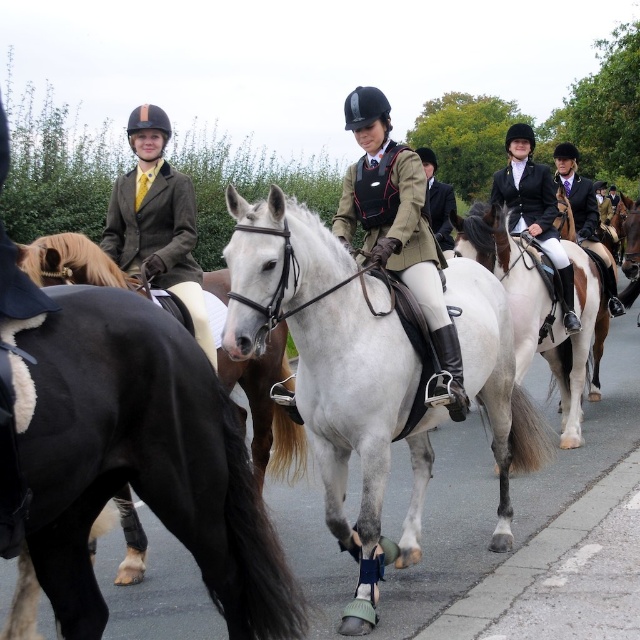
Does black leather jacket at center appear over matte black jacket at center?

No, black leather jacket at center is not above matte black jacket at center.

Is black leather jacket at center behind matte black jacket at center?

No, it is not.

Who is more distant from viewer, [518,216] or [608,264]?

The point [608,264] is behind.

The height and width of the screenshot is (640, 640). What are the coordinates of `black leather jacket at center` in the screenshot? It's located at (532, 209).

Is matte black vest at center wider than matte black jacket at center?

Incorrect, matte black vest at center's width does not surpass matte black jacket at center's.

Does matte black vest at center appear over matte black jacket at center?

Incorrect, matte black vest at center is not positioned above matte black jacket at center.

The image size is (640, 640). Describe the element at coordinates (400, 230) in the screenshot. I see `matte black vest at center` at that location.

Where is `matte black vest at center`? matte black vest at center is located at coordinates (400, 230).

Is white glossy horse at center in front of matte black vest at center?

No.

Who is shorter, white glossy horse at center or matte black vest at center?

white glossy horse at center

This screenshot has height=640, width=640. What do you see at coordinates (445, 532) in the screenshot?
I see `white glossy horse at center` at bounding box center [445, 532].

The image size is (640, 640). Identify the location of white glossy horse at center. (445, 532).